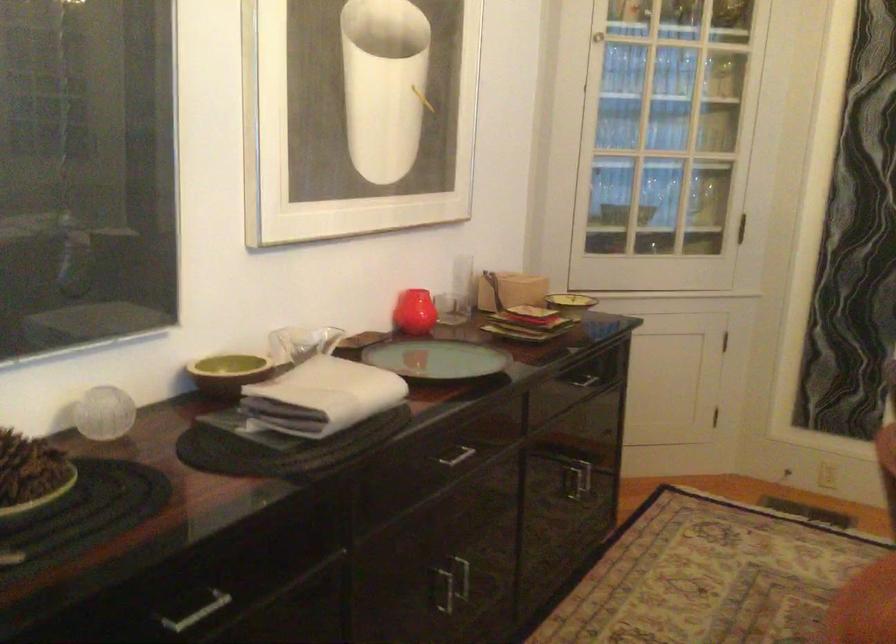
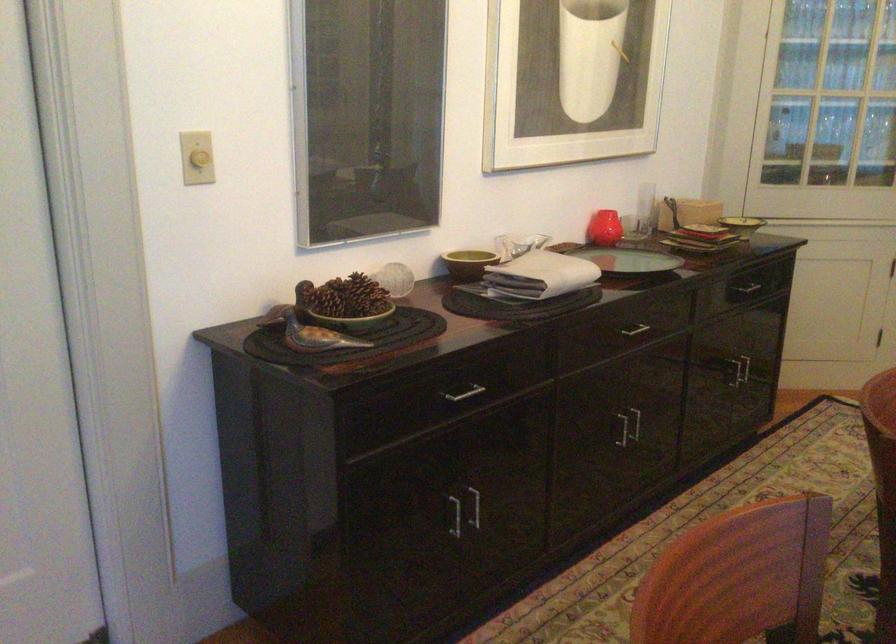
In the second image, find the point that corresponds to pixel 408 313 in the first image.

(604, 228)